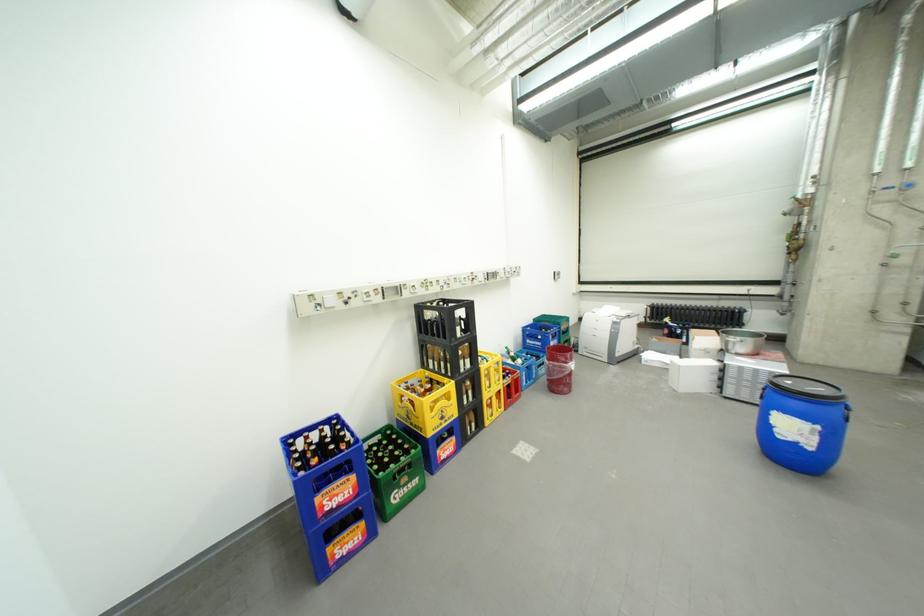
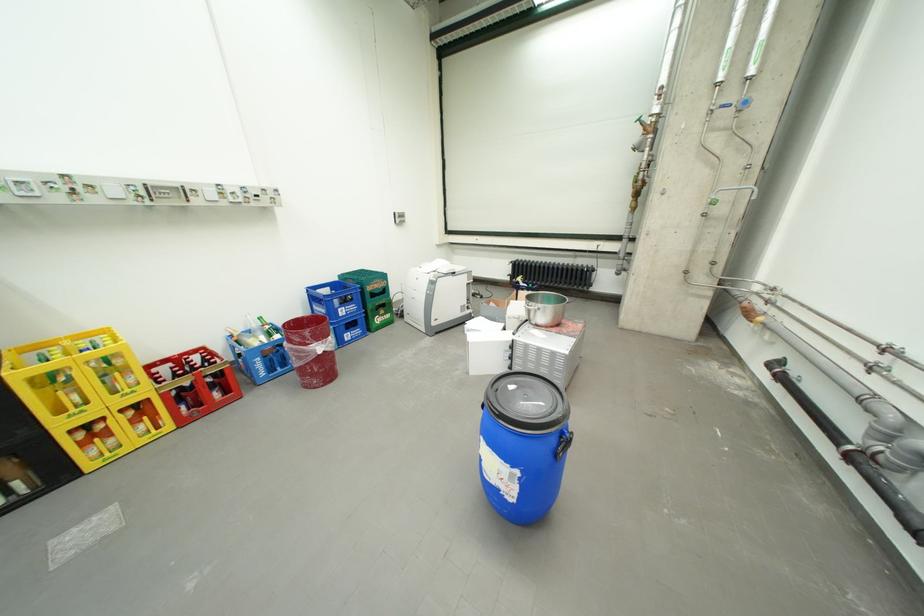
Locate, in the second image, the point that corresponds to the point at 515,389 in the first image.

(172, 397)